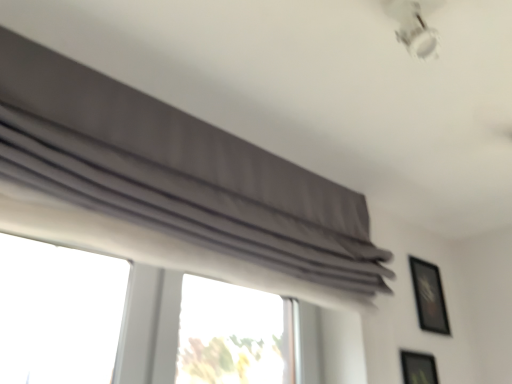
Question: From the image's perspective, relative to white glossy lamp at upper right, is black glossy picture frame at upper right, which appears as the second picture frame when ordered from the bottom, above or below?

Choices:
 (A) above
 (B) below

Answer: (B)

Question: Which is correct: black glossy picture frame at upper right, which ranks as the 2th picture frame in front-to-back order, is inside white glossy lamp at upper right, or outside of it?

Choices:
 (A) inside
 (B) outside

Answer: (B)

Question: Considering the real-world distances, which object is farthest from the black glossy picture frame at upper right, acting as the 1th picture frame starting from the back?

Choices:
 (A) matte black picture frame at lower right, which is counted as the 1th picture frame, starting from the front
 (B) white glossy lamp at upper right
 (C) gray fabric curtain at upper center

Answer: (B)

Question: Estimate the real-world distances between objects in this image. Which object is closer to the gray fabric curtain at upper center?

Choices:
 (A) black glossy picture frame at upper right, which ranks as the 2th picture frame in front-to-back order
 (B) white glossy lamp at upper right
 (C) matte black picture frame at lower right, which is counted as the 1th picture frame, starting from the front

Answer: (B)